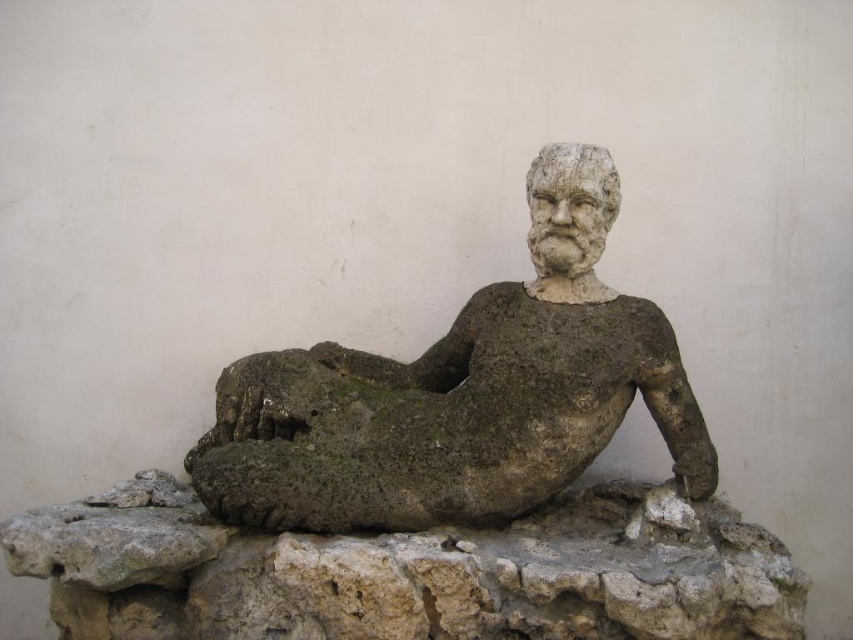
Question: Is gray stone reclining figure at center below gray stone at center?

Choices:
 (A) no
 (B) yes

Answer: (A)

Question: Among these objects, which one is farthest from the camera?

Choices:
 (A) gray stone at center
 (B) gray stone reclining figure at center

Answer: (B)

Question: Where is gray stone reclining figure at center located in relation to gray stone at center in the image?

Choices:
 (A) above
 (B) below

Answer: (A)

Question: Is gray stone reclining figure at center above gray stone at center?

Choices:
 (A) no
 (B) yes

Answer: (B)